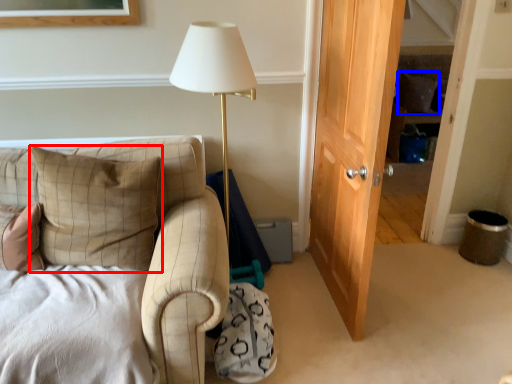
Question: Which point is closer to the camera, pillow (highlighted by a red box) or pillow (highlighted by a blue box)?

Choices:
 (A) pillow
 (B) pillow

Answer: (A)